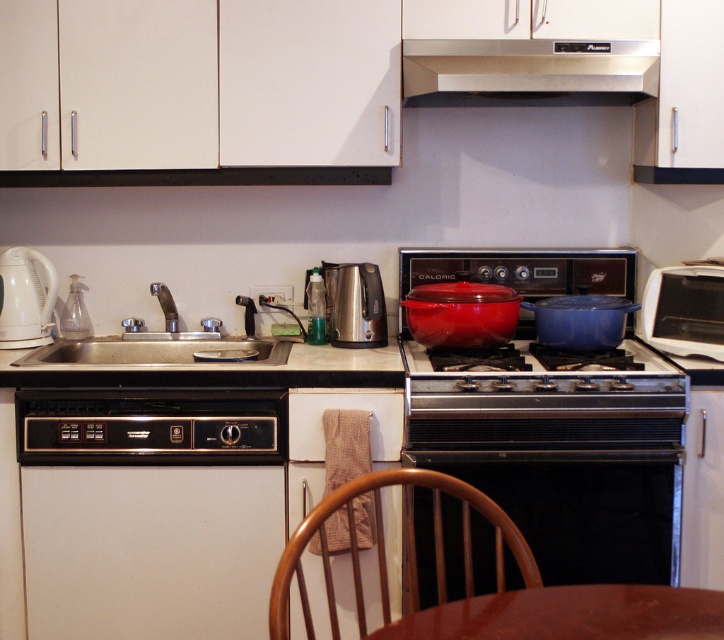
Question: Can you confirm if stainless steel exhaust hood at upper center is positioned to the right of white glossy electric kettle at left?

Choices:
 (A) no
 (B) yes

Answer: (B)

Question: Is stainless steel exhaust hood at upper center thinner than brushed metal kettle at center?

Choices:
 (A) no
 (B) yes

Answer: (A)

Question: In this image, where is black matte oven at center located relative to stainless steel sink at center?

Choices:
 (A) left
 (B) right

Answer: (B)

Question: Which object appears farthest from the camera in this image?

Choices:
 (A) beige laminate countertop at lower left
 (B) black matte oven at center

Answer: (A)

Question: Which point appears farthest from the camera in this image?

Choices:
 (A) (355, 275)
 (B) (167, 588)
 (C) (0, 330)
 (D) (463, 550)

Answer: (A)

Question: Among these objects, which one is nearest to the camera?

Choices:
 (A) brown wood chair at lower center
 (B) white matte dishwasher at lower left

Answer: (A)